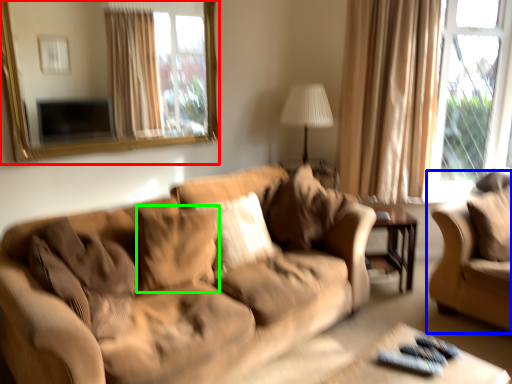
Question: Which object is positioned farthest from mirror (highlighted by a red box)? Select from studio couch (highlighted by a blue box) and pillow (highlighted by a green box).

Choices:
 (A) studio couch
 (B) pillow

Answer: (A)